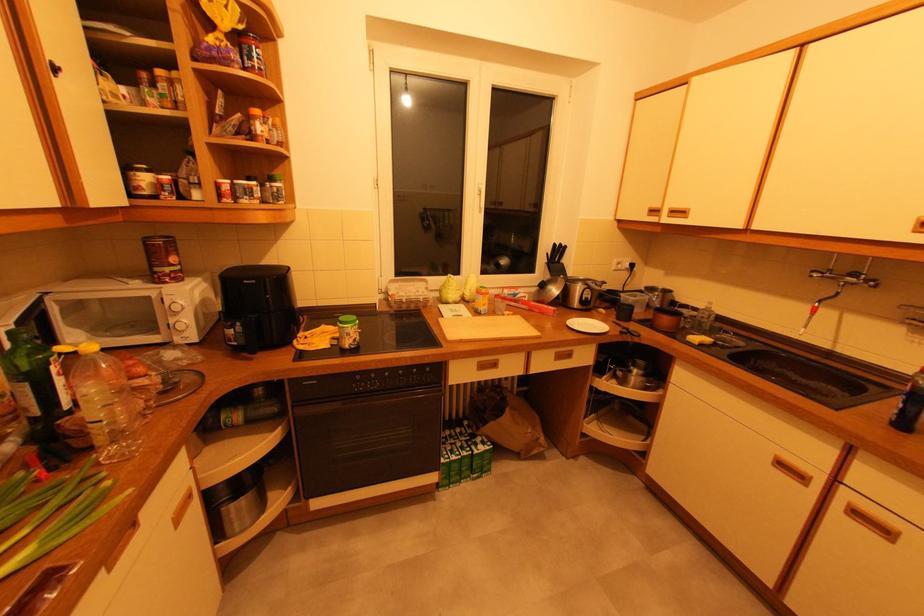
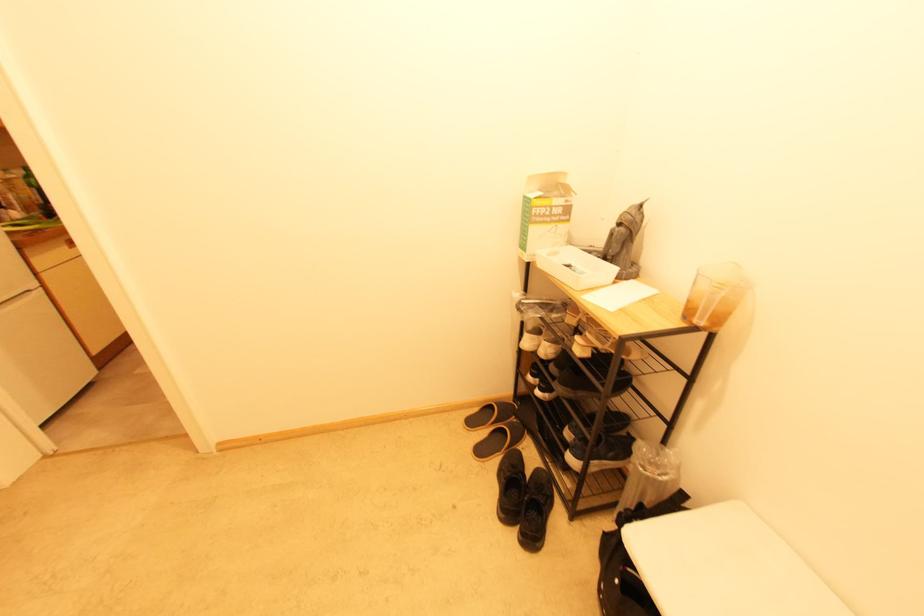
Question: I am providing you with two images of the same scene from different viewpoints. After the viewpoint changes to image2, which objects are now occluded?

Choices:
 (A) black backpack
 (B) faucet spray head
 (C) chair sitting surface
 (D) crumpled white tissue

Answer: (B)